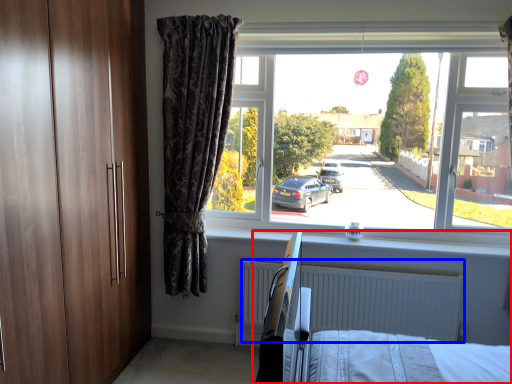
Question: Which point is closer to the camera, hospital bed (highlighted by a red box) or radiator (highlighted by a blue box)?

Choices:
 (A) hospital bed
 (B) radiator

Answer: (A)